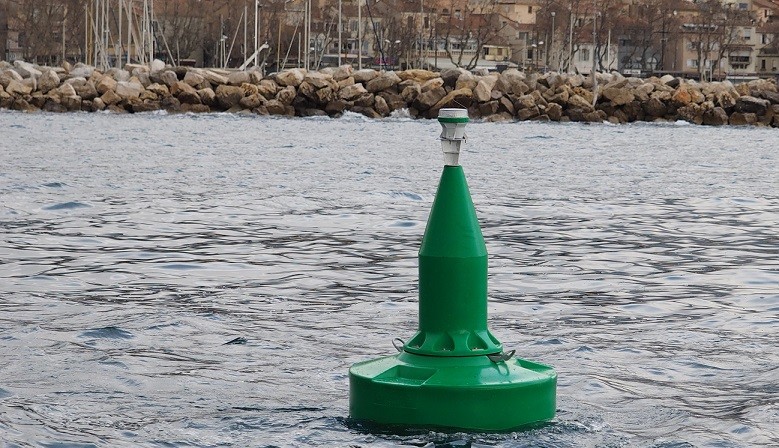
Locate an element on the screen. This screenshot has width=779, height=448. windows is located at coordinates (742, 65), (696, 23), (686, 46), (580, 53), (587, 22).